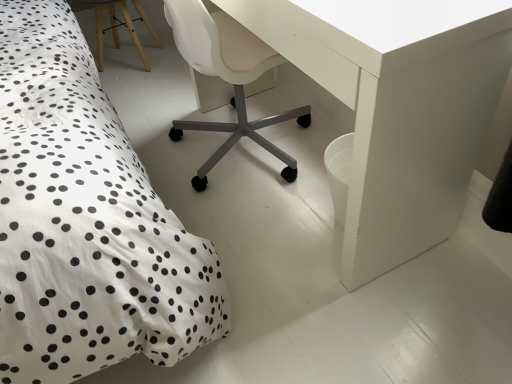
Question: Considering the relative positions of white glossy table at center and white plastic chair at center in the image provided, is white glossy table at center to the left of white plastic chair at center from the viewer's perspective?

Choices:
 (A) yes
 (B) no

Answer: (B)

Question: Could you tell me if white glossy table at center is turned towards white plastic chair at center?

Choices:
 (A) no
 (B) yes

Answer: (B)

Question: Is white plastic chair at center a part of white glossy table at center?

Choices:
 (A) yes
 (B) no

Answer: (A)

Question: Does white glossy table at center appear on the right side of white plastic chair at center?

Choices:
 (A) no
 (B) yes

Answer: (B)

Question: Is white glossy table at center not near white plastic chair at center?

Choices:
 (A) yes
 (B) no

Answer: (B)

Question: From the image's perspective, is white glossy table at center above white plastic chair at center?

Choices:
 (A) yes
 (B) no

Answer: (B)

Question: Is white plastic chair at center further to the viewer compared to white glossy table at center?

Choices:
 (A) yes
 (B) no

Answer: (A)

Question: From the image's perspective, does white plastic chair at center appear higher than white glossy table at center?

Choices:
 (A) yes
 (B) no

Answer: (A)

Question: Considering the relative sizes of white plastic chair at center and white glossy table at center in the image provided, is white plastic chair at center bigger than white glossy table at center?

Choices:
 (A) yes
 (B) no

Answer: (B)

Question: Considering the relative sizes of white plastic chair at center and white glossy table at center in the image provided, is white plastic chair at center taller than white glossy table at center?

Choices:
 (A) no
 (B) yes

Answer: (A)

Question: Is white plastic chair at center turned away from white glossy table at center?

Choices:
 (A) yes
 (B) no

Answer: (A)

Question: From a real-world perspective, does white plastic chair at center sit lower than white glossy table at center?

Choices:
 (A) yes
 (B) no

Answer: (A)

Question: Relative to white glossy table at center, is white plastic chair at center in front or behind?

Choices:
 (A) behind
 (B) front

Answer: (A)